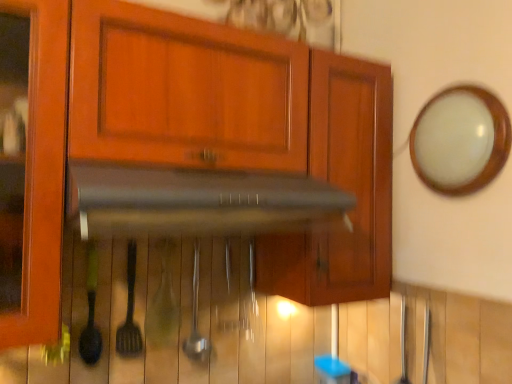
Question: Looking at the image, does metallic spatula at center, which is counted as the 2th silverware, starting from the right, seem bigger or smaller compared to white glossy mirror at upper right?

Choices:
 (A) big
 (B) small

Answer: (B)

Question: Visually, is metallic spatula at center, positioned as the 1th silverware in left-to-right order, positioned to the left or to the right of white glossy mirror at upper right?

Choices:
 (A) right
 (B) left

Answer: (B)

Question: Which of these objects is positioned farthest from the satin silver spoon at center, the 1th silverware from the right?

Choices:
 (A) wooden cabinet at center
 (B) black matte vent at center
 (C) metallic spatula at center, positioned as the 1th silverware in left-to-right order
 (D) white glossy mirror at upper right

Answer: (D)

Question: Which of these objects is positioned closest to the wooden cabinet at center?

Choices:
 (A) metallic spatula at center, positioned as the 1th silverware in left-to-right order
 (B) white glossy mirror at upper right
 (C) satin silver spoon at center, the 1th silverware from the right
 (D) black matte vent at center

Answer: (D)